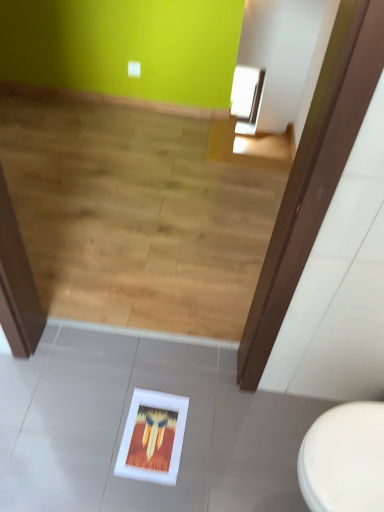
Where is `free space above white glossy toilet at lower right (from a real-world perspective)`? free space above white glossy toilet at lower right (from a real-world perspective) is located at coordinates (356, 451).